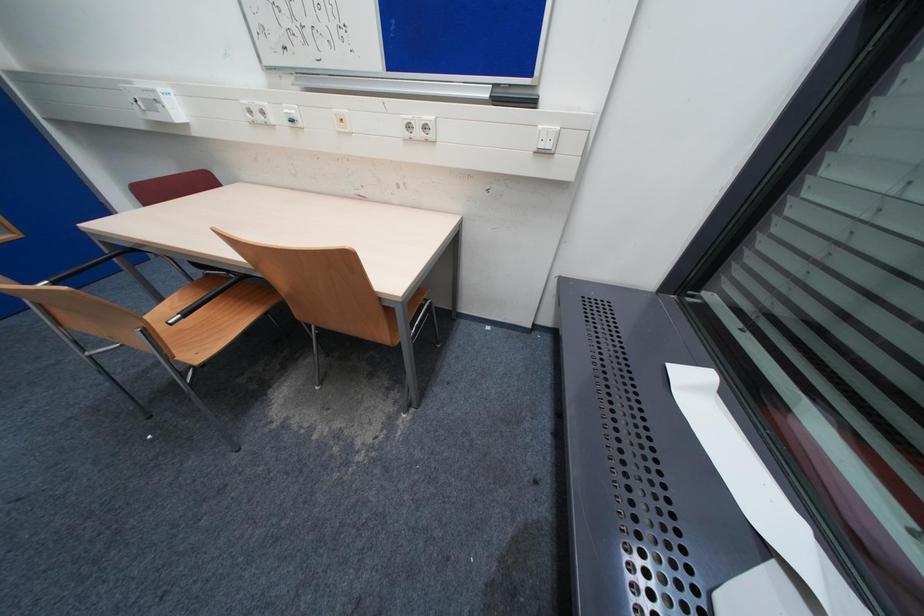
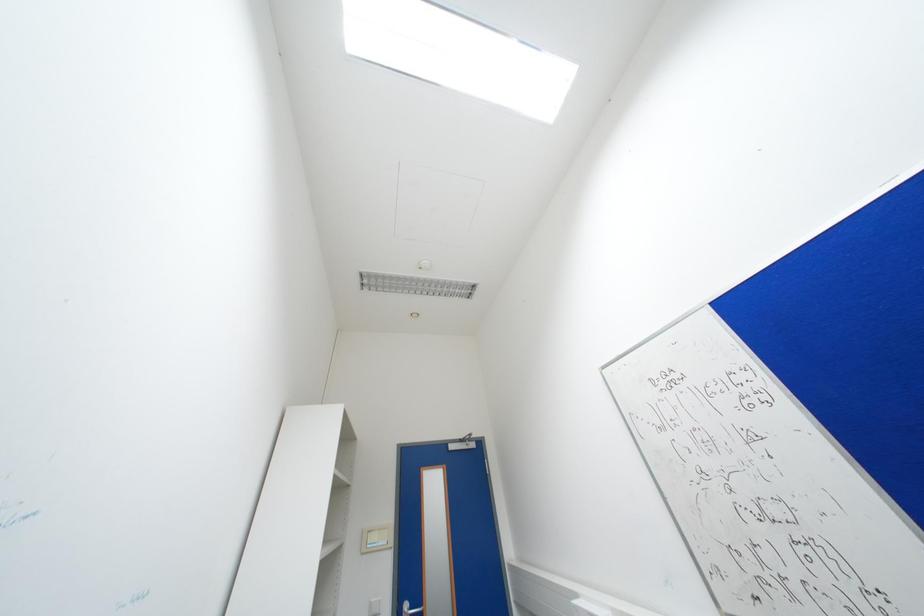
The images are taken continuously from a first-person perspective. In which direction is your viewpoint rotating?

The camera's rotation is toward left-up.